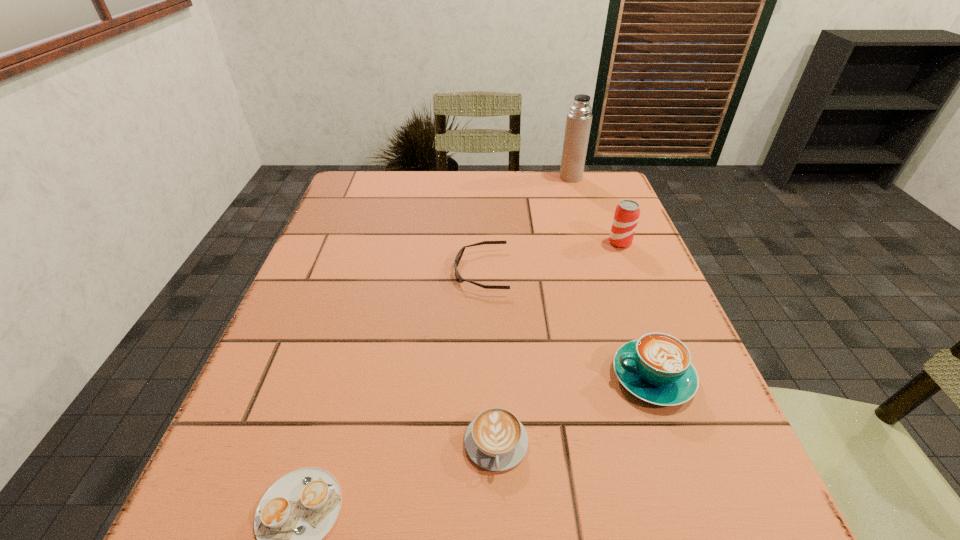
Locate an element on the screen. Image resolution: width=960 pixels, height=540 pixels. vacant space located on the left of the second farthest object is located at coordinates (562, 242).

This screenshot has height=540, width=960. In order to click on free space located with the handle on the right side of the tallest cappuccino in this screenshot , I will do `click(478, 377)`.

The width and height of the screenshot is (960, 540). In order to click on vacant space located with the handle on the right side of the tallest cappuccino in this screenshot , I will do click(443, 377).

At what (x,y) coordinates should I click in order to perform the action: click on free space located 0.400m with the handle on the right side of the tallest cappuccino. Please return your answer as a coordinate pair (x, y). Looking at the image, I should click on (378, 377).

The height and width of the screenshot is (540, 960). In order to click on vacant region located 0.070m on the side of the second tallest cappuccino with the handle in this screenshot , I will do `click(498, 530)`.

Find the location of a particular element. free space located 0.070m on the front-facing side of the third farthest object is located at coordinates (422, 271).

I want to click on blank area located 0.080m on the front-facing side of the third farthest object, so click(419, 271).

This screenshot has width=960, height=540. In order to click on vacant space located 0.280m on the front-facing side of the third farthest object in this screenshot , I will do `click(327, 271)`.

Find the location of `object that is at the far edge`. object that is at the far edge is located at coordinates (578, 124).

This screenshot has width=960, height=540. What are the coordinates of `thermos bottle that is at the right edge` in the screenshot? It's located at (578, 124).